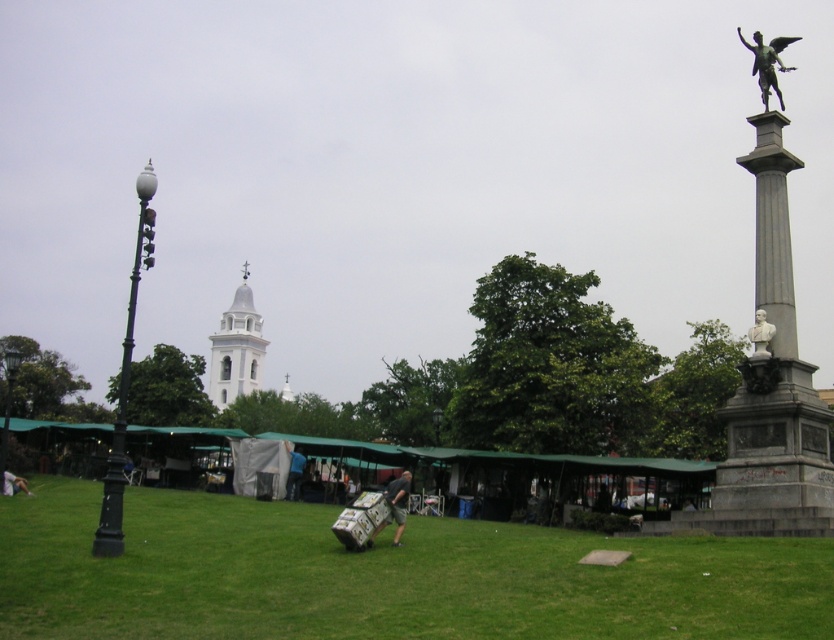
Does point (765, 99) lie behind point (757, 312)?

Yes, it is.

Which is behind, point (752, 74) or point (762, 310)?

Positioned behind is point (752, 74).

Describe the element at coordinates (767, 64) in the screenshot. I see `bronze statue at upper right` at that location.

Locate an element on the screen. Image resolution: width=834 pixels, height=640 pixels. bronze statue at upper right is located at coordinates (767, 64).

Which of these two, white stucco tower at center or blue fabric at center, stands shorter?

With less height is blue fabric at center.

Does point (214, 355) come closer to viewer compared to point (289, 476)?

No, it is not.

This screenshot has height=640, width=834. I want to click on white stucco tower at center, so click(235, 348).

Identify the location of white stucco tower at center. pos(235,348).

In the scene shown: Does gray stone statue at right have a lesser width compared to blue fabric at center?

Incorrect, gray stone statue at right's width is not less than blue fabric at center's.

Can you confirm if gray stone statue at right is positioned above blue fabric at center?

Correct, gray stone statue at right is located above blue fabric at center.

Locate an element on the screen. gray stone statue at right is located at coordinates (772, 368).